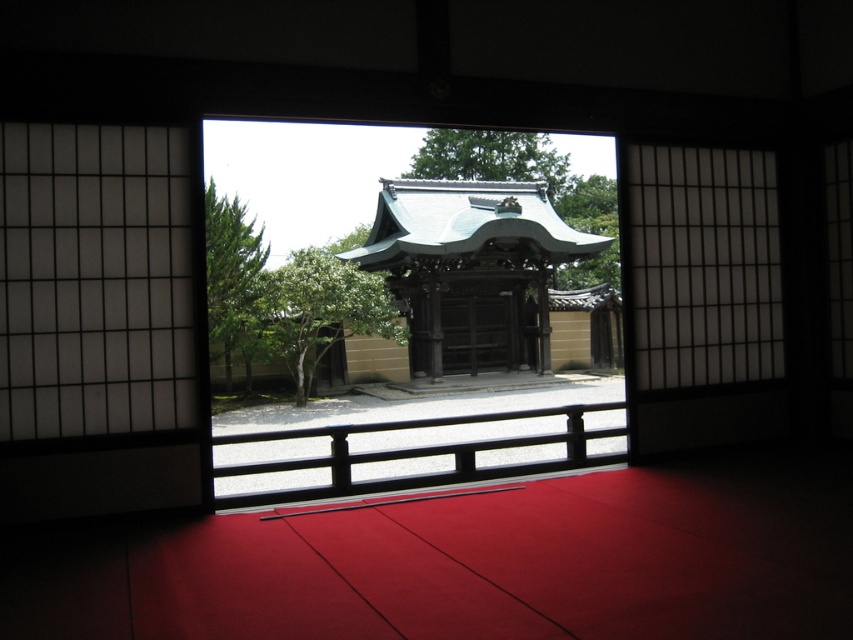
You are an interior designer planning to place a 1.2 meter wide painting between the transparent glass window at center and the wooden at center. Given their widths, will the painting fit horizontally between them?

The transparent glass window at center is wider than the wooden at center. However, the exact distance between them isn not specified. Without knowing the spacing between the two objects, it is impossible to determine if the painting will fit horizontally.

You are a delivery robot with a package that is 10 feet long. You need to move through the space between the transparent glass window at center and the wooden at center. Can you fit through that space?

The distance between the transparent glass window at center and the wooden at center is 12.63 feet, which is greater than the 10 feet length of the package. Therefore, the delivery robot can fit through the space between them.